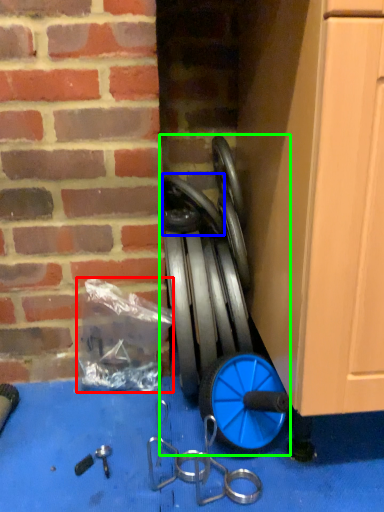
Question: Considering the real-world distances, which object is farthest from garbage (highlighted by a red box)? wheel (highlighted by a blue box) or garden hose (highlighted by a green box)?

Choices:
 (A) wheel
 (B) garden hose

Answer: (A)